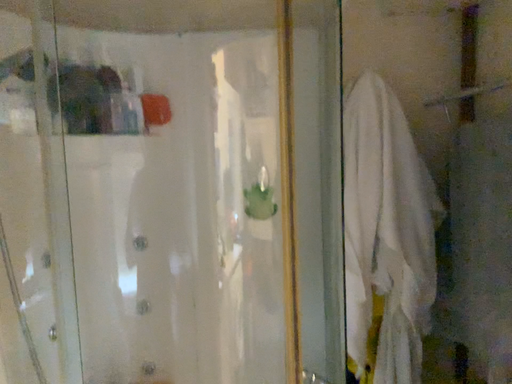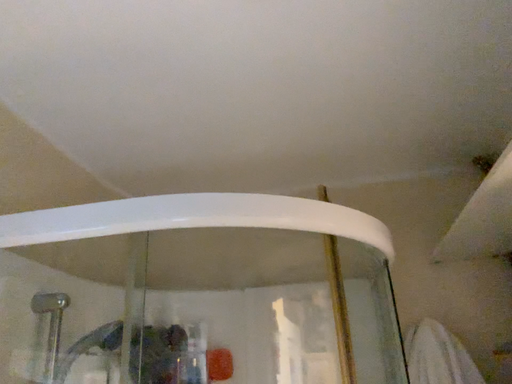
Question: How did the camera likely rotate when shooting the video?

Choices:
 (A) rotated downward
 (B) rotated upward

Answer: (B)